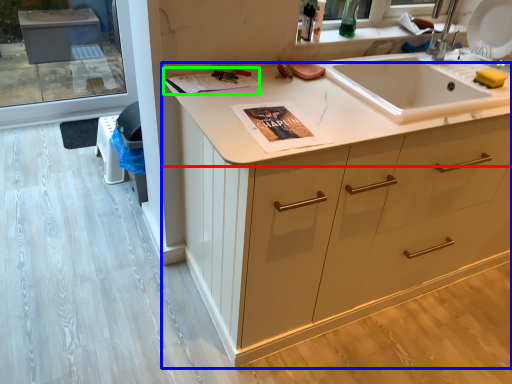
Question: Based on their relative distances, which object is nearer to countertop (highlighted by a red box)? Choose from cabinetry (highlighted by a blue box) and magazine (highlighted by a green box).

Choices:
 (A) cabinetry
 (B) magazine

Answer: (B)